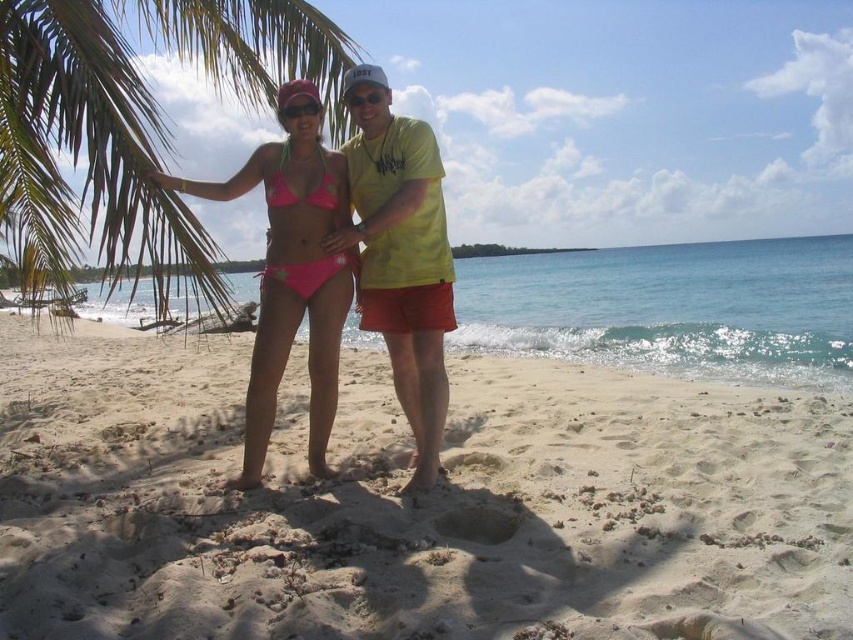
You are a photographer standing at the edge of the beach. You want to take a photo that includes both the yellow matte shirt at center and the pink fabric bikini at center. Which one should you focus on first to ensure both are in clear view?

The yellow matte shirt at center is closer to the viewer than the pink fabric bikini at center, so focusing on the yellow matte shirt at center first will help ensure both are in clear view.

You are a photographer trying to capture the best shot of the two people in the scene. Since the yellow matte shirt at center and the pink fabric bikini at center are overlapping, which one is covering the other?

The yellow matte shirt at center is positioned over pink fabric bikini at center, so the yellow matte shirt at center is covering the pink fabric bikini at center.